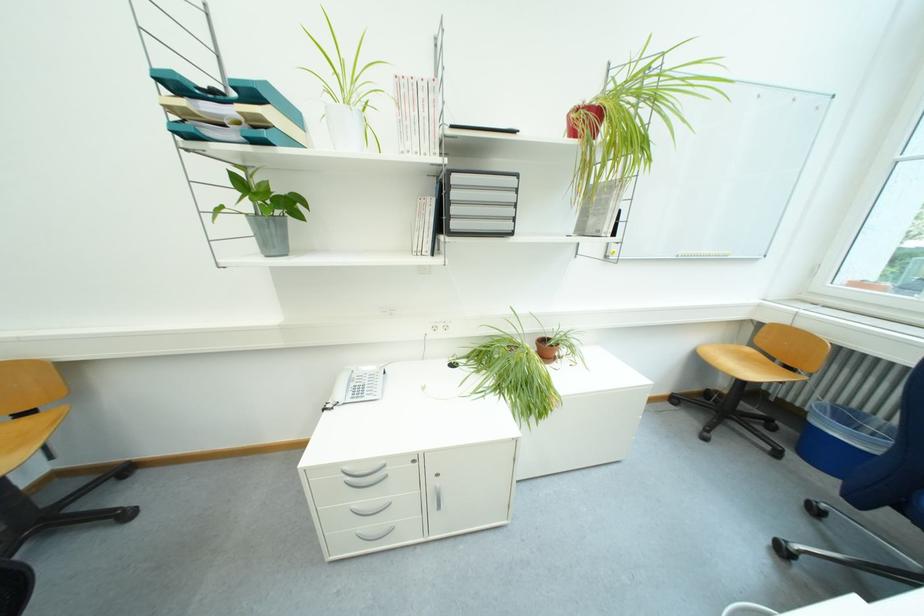
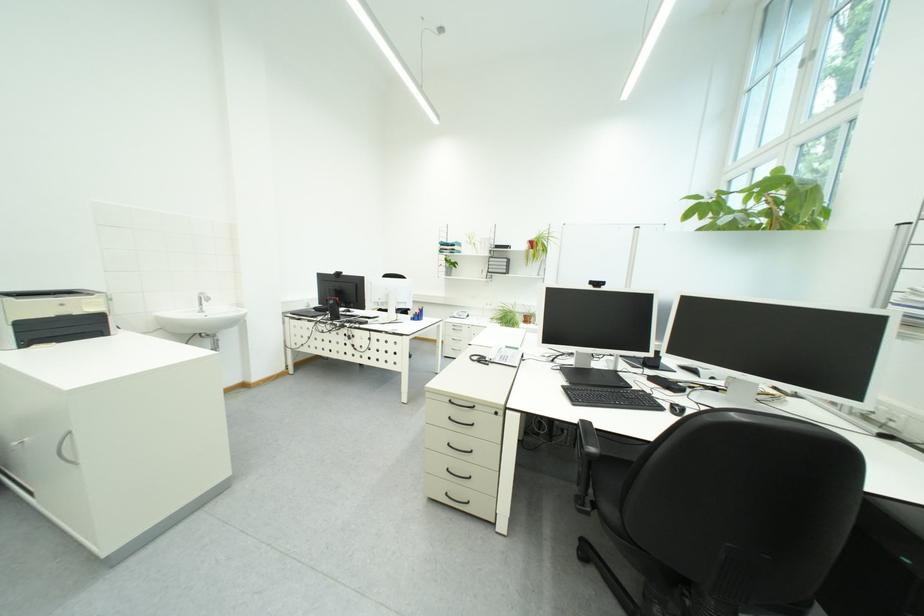
Question: I am providing you with two images of the same scene from different viewpoints. Which of the following objects are not visible in image2?

Choices:
 (A) drawer handle
 (B) silver drawer handle
 (C) printer scanner lid
 (D) sink faucet lever

Answer: (B)